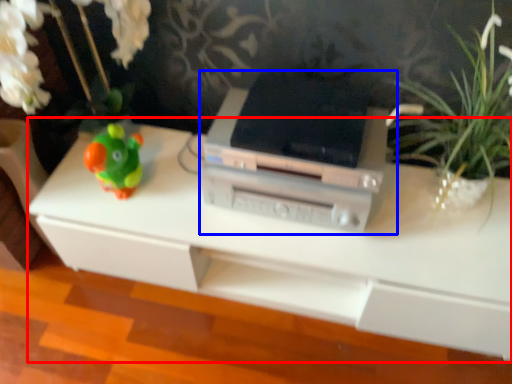
Question: Which object appears closest to the camera in this image, table (highlighted by a red box) or printer (highlighted by a blue box)?

Choices:
 (A) table
 (B) printer

Answer: (A)